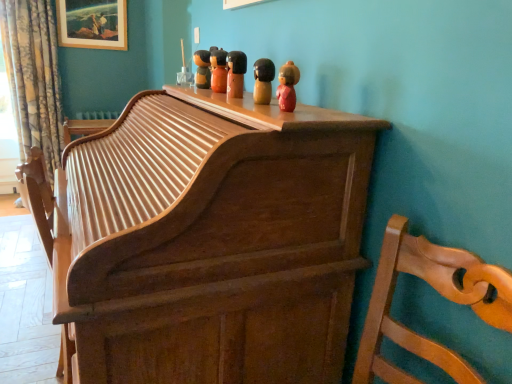
Locate an element on the screen. The image size is (512, 384). free spot in front of wooden figurine at center, acting as the 2th toy starting from the front is located at coordinates (284, 112).